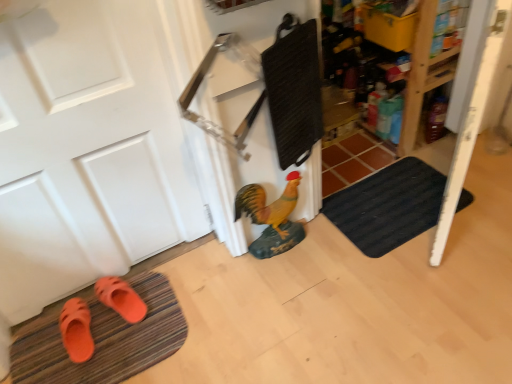
At what (x,y) coordinates should I click in order to perform the action: click on free space between orange rubber sandals at lower left, the 2th footwear viewed from the right, and orange rubber slipper at lower left, which ranks as the 2th footwear in left-to-right order. Please return your answer as a coordinate pair (x, y). The width and height of the screenshot is (512, 384). Looking at the image, I should click on (104, 327).